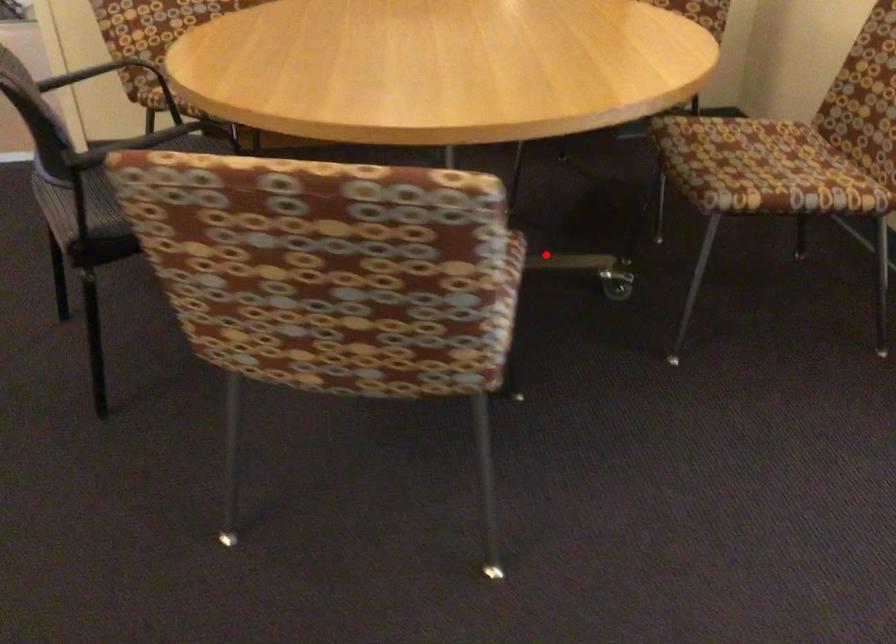
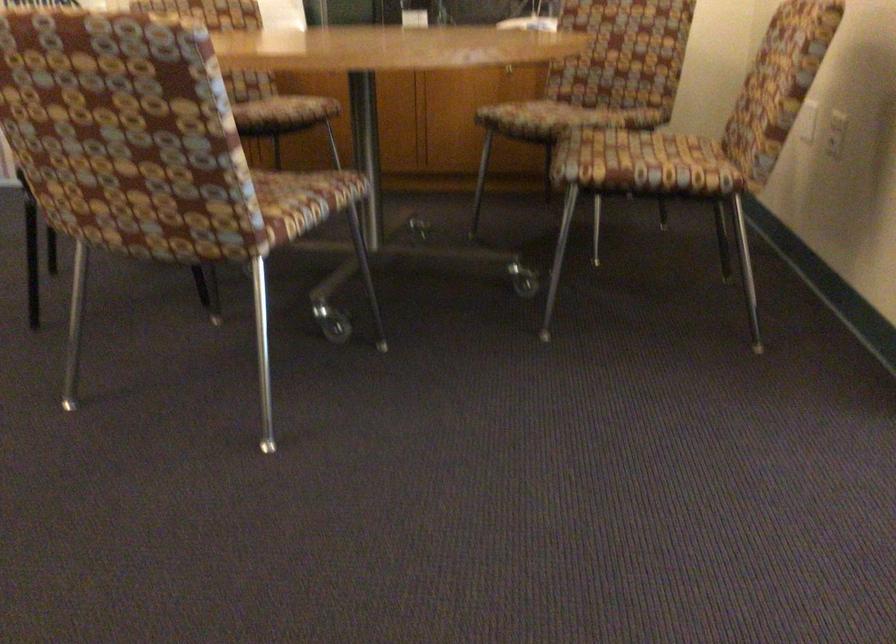
Question: I am providing you with two images of the same scene from different viewpoints. A red point is marked on the first image. Can you still see the location of the red point in image 2?

Choices:
 (A) Yes
 (B) No

Answer: (B)